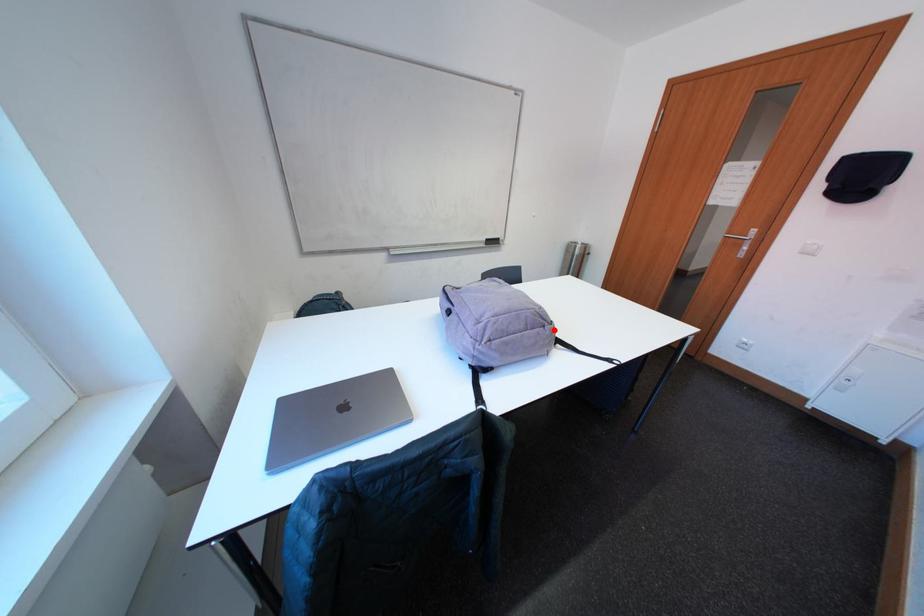
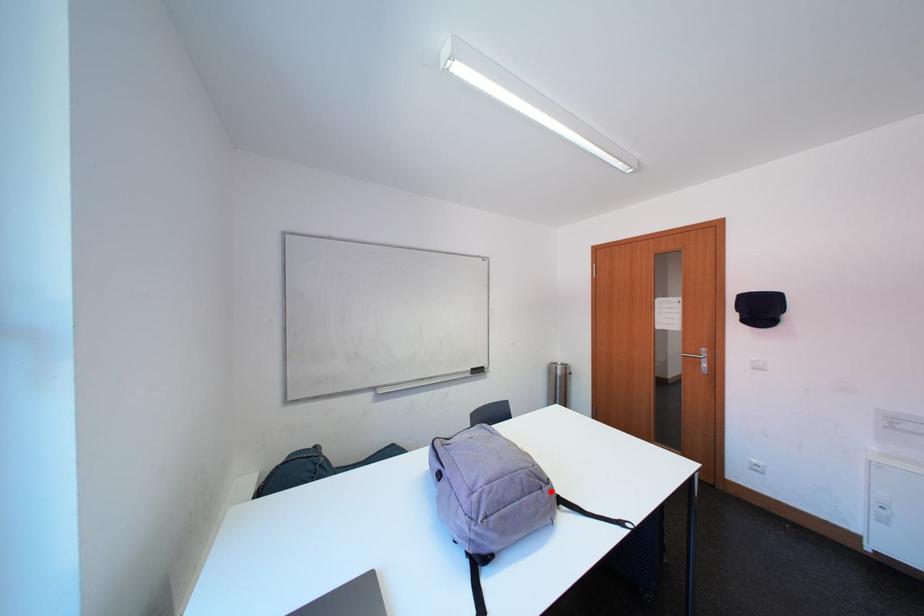
I am providing you with two images of the same scene from different viewpoints. A red point is marked on the first image and another point is marked on the second image. Is the marked point in image1 the same physical position as the marked point in image2?

Yes